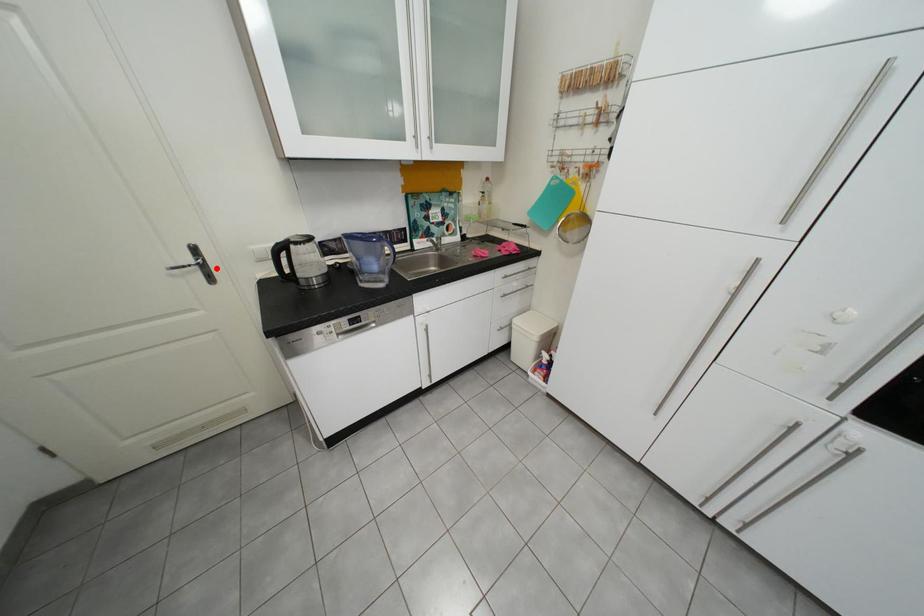
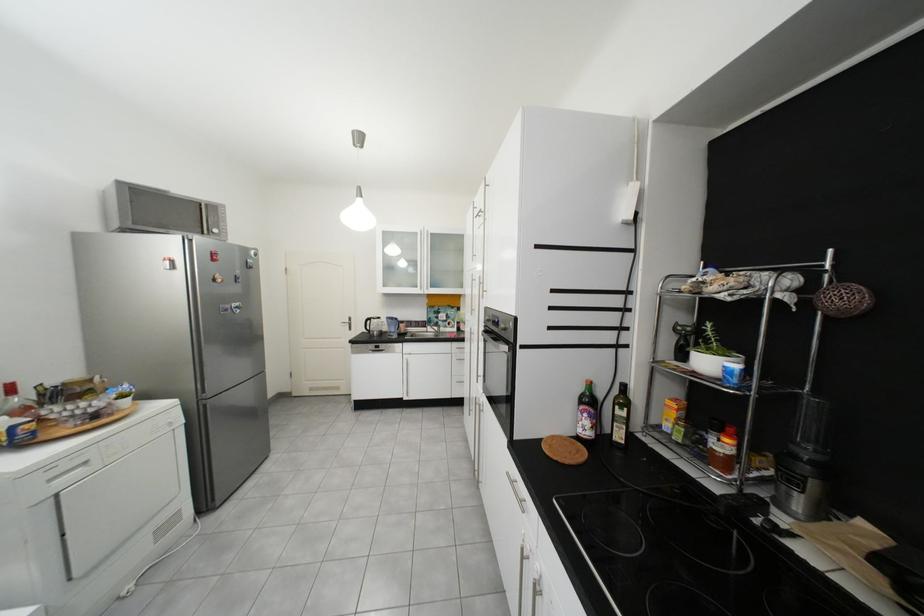
Locate, in the second image, the point that corresponds to the highlighted location in the first image.

(361, 325)